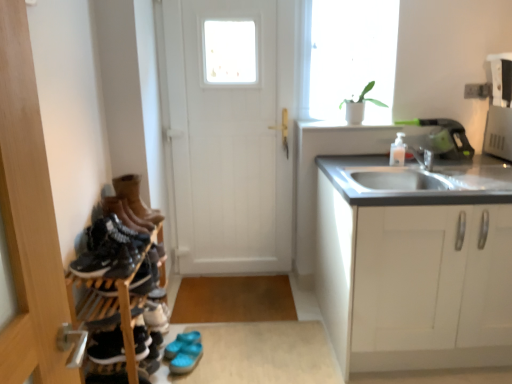
What are the coordinates of `vacant location below white matte door at center (from a real-world perspective)` in the screenshot? It's located at (238, 270).